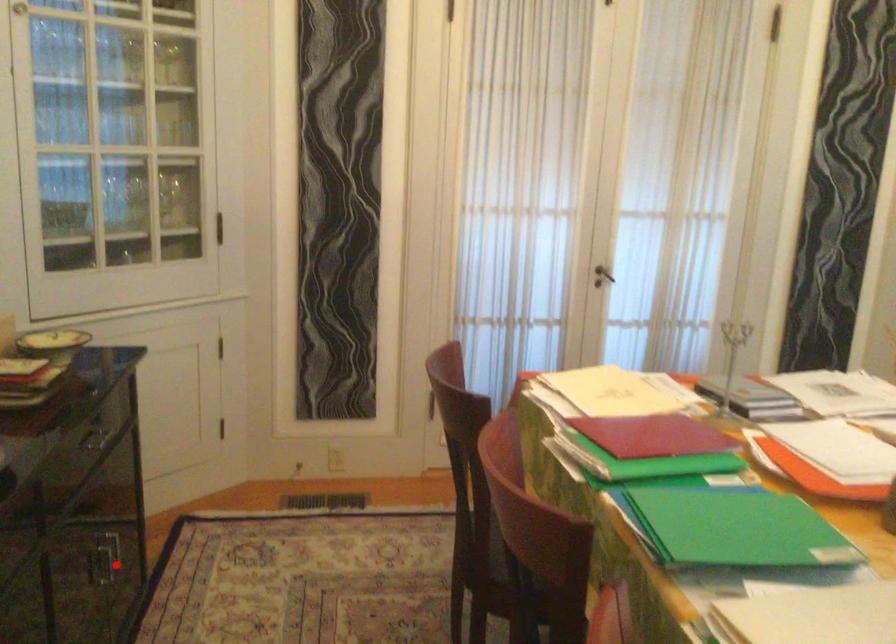
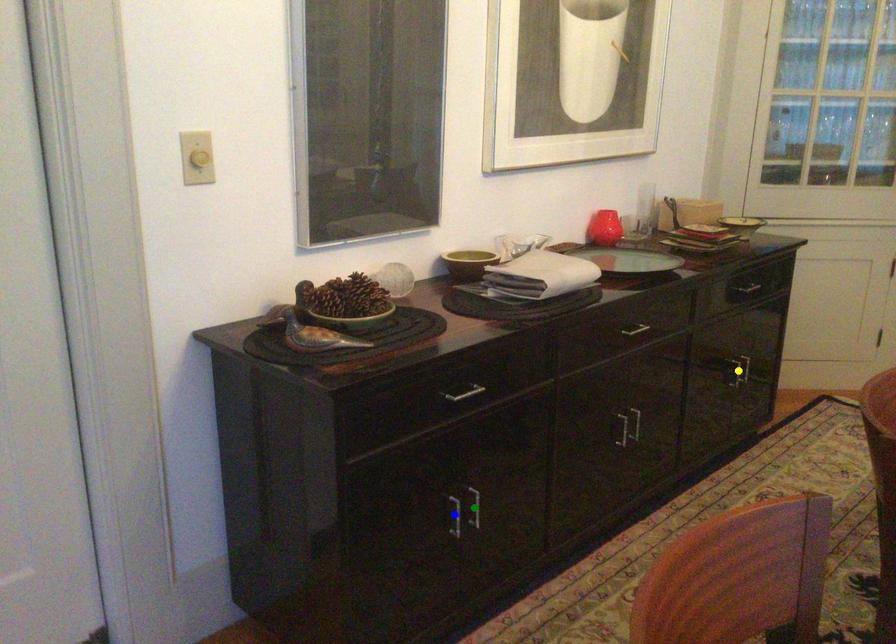
Question: I am providing you with two images of the same scene from different viewpoints. A red point is marked on the first image. You are given multiple points on the second image. Which point in image 2 is actually the same real-world point as the red point in image 1?

Choices:
 (A) green point
 (B) yellow point
 (C) blue point

Answer: (B)